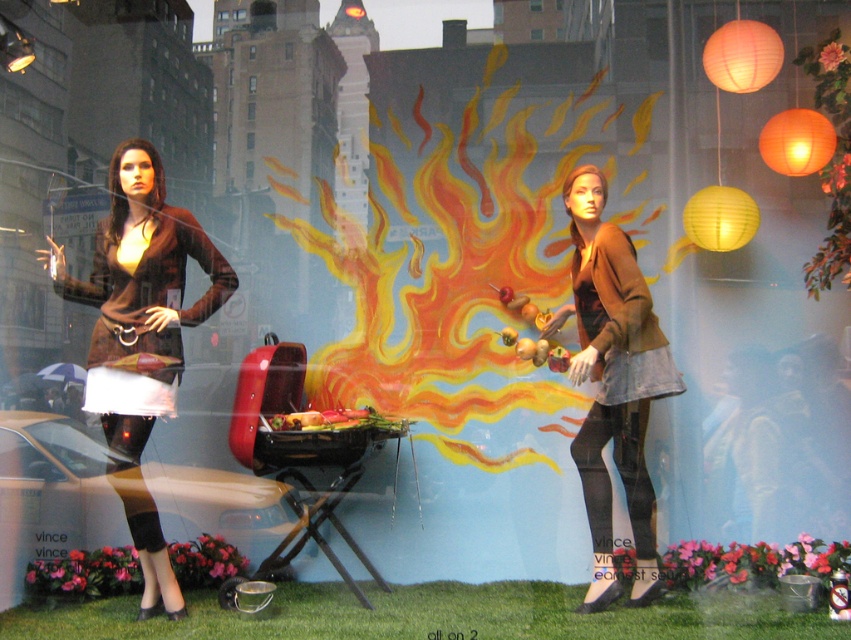
Describe the element at coordinates (141, 268) in the screenshot. I see `matte brown sweater at left` at that location.

Find the location of `matte brown sweater at left`. matte brown sweater at left is located at coordinates (141, 268).